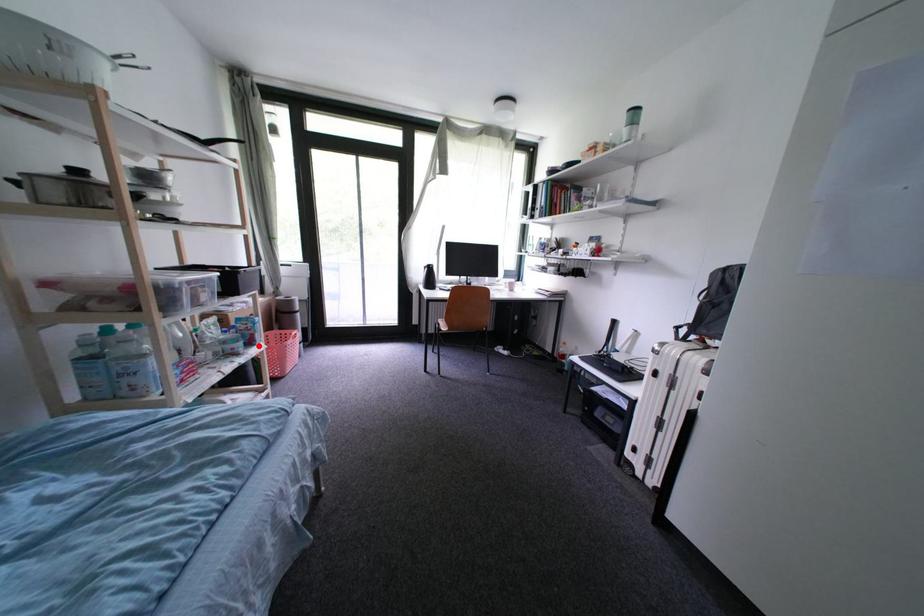
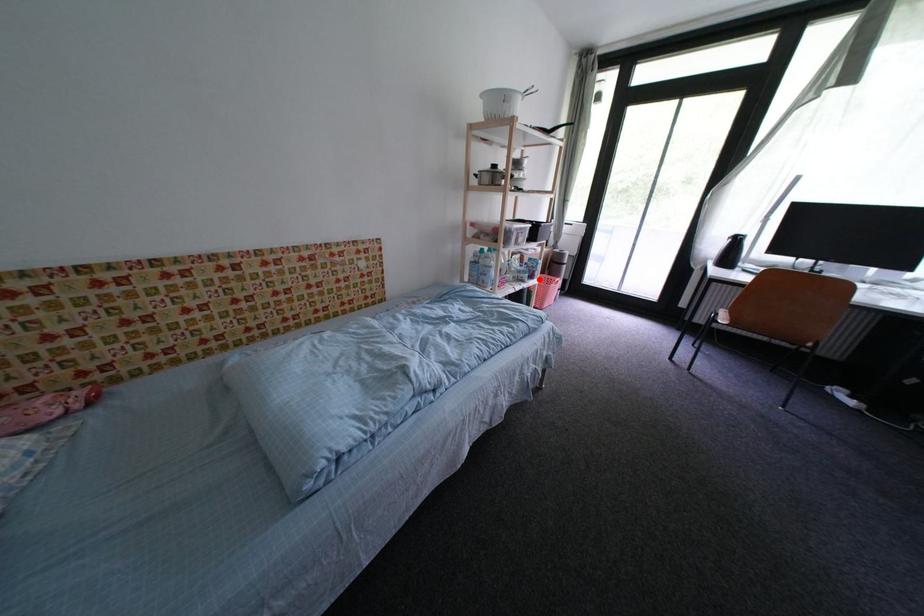
I am providing you with two images of the same scene from different viewpoints. A red point is marked on the first image and another point is marked on the second image. Is the marked point in image1 the same physical position as the marked point in image2?

Yes